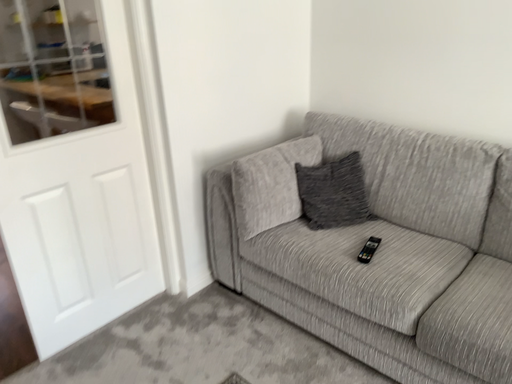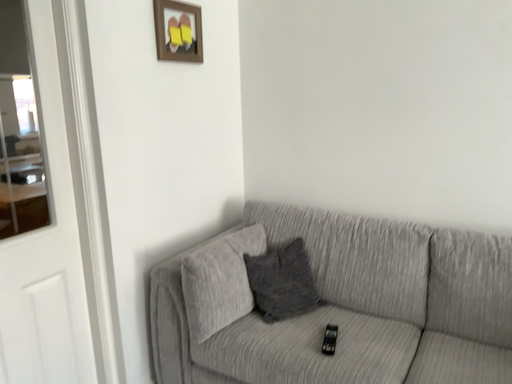
Question: How did the camera likely rotate when shooting the video?

Choices:
 (A) rotated downward
 (B) rotated upward

Answer: (B)